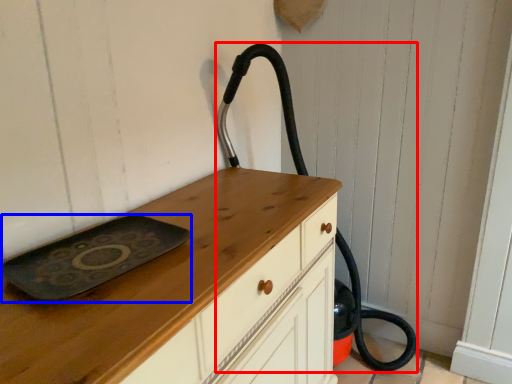
Question: Which point is further to the camera, fire hose (highlighted by a red box) or tray (highlighted by a blue box)?

Choices:
 (A) fire hose
 (B) tray

Answer: (A)